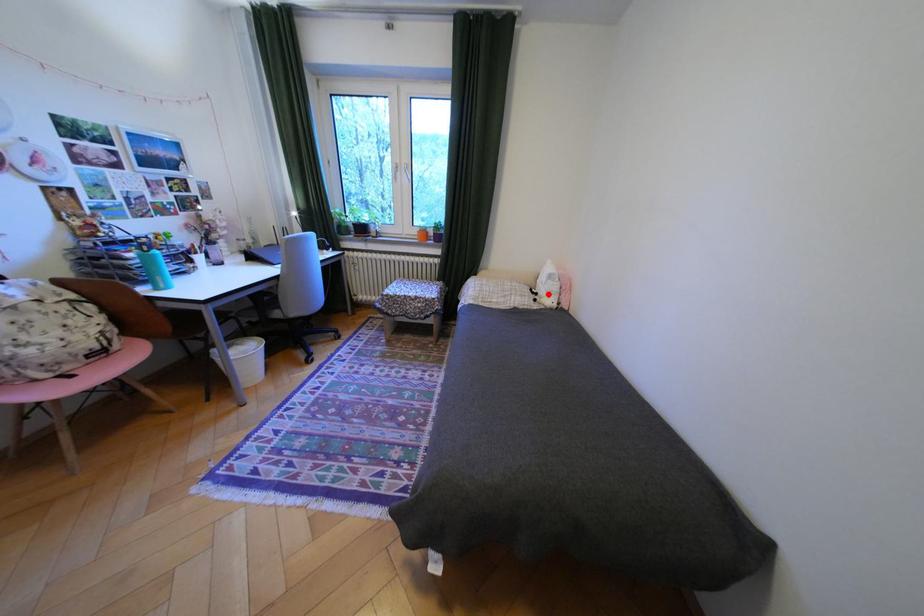
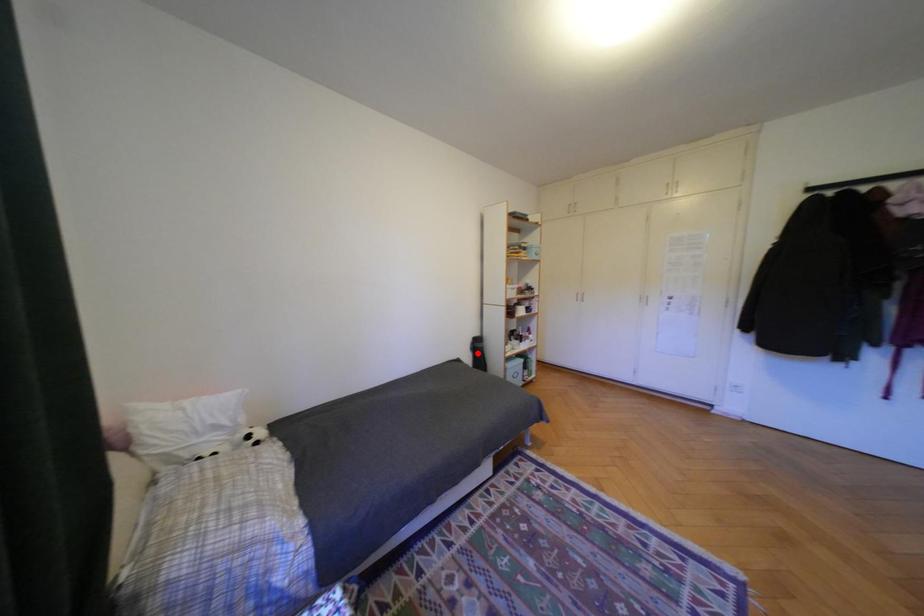
I am providing you with two images of the same scene from different viewpoints. A red point is marked on the first image and another point is marked on the second image. Is the marked point in image1 the same physical position as the marked point in image2?

No